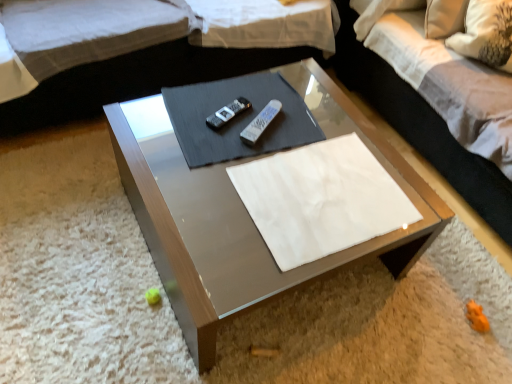
Image resolution: width=512 pixels, height=384 pixels. Describe the element at coordinates (321, 199) in the screenshot. I see `white paper at center` at that location.

Find the location of a particular element. The width and height of the screenshot is (512, 384). metallic glass coffee table at center is located at coordinates (248, 219).

What do you see at coordinates (143, 31) in the screenshot?
I see `white fabric couch at upper center` at bounding box center [143, 31].

This screenshot has height=384, width=512. Describe the element at coordinates (227, 113) in the screenshot. I see `black plastic remote at center, placed as the first remote when sorted from left to right` at that location.

In order to click on white paper at center in this screenshot , I will do `click(321, 199)`.

Is the position of white paper at center more distant than that of black plastic remote at center, arranged as the second remote when viewed from the right?

That is False.

Where is `remote below the white paper at center (from a real-world perspective)`? The height and width of the screenshot is (384, 512). remote below the white paper at center (from a real-world perspective) is located at coordinates (227, 113).

Would you say black plastic remote at center, arranged as the second remote when viewed from the right, is part of white paper at center's contents?

No, black plastic remote at center, arranged as the second remote when viewed from the right, is located outside of white paper at center.

Can you tell me how much white fabric pillow at upper right and black plastic remote at center, placed as the first remote when sorted from left to right, differ in facing direction?

The angle between the facing direction of white fabric pillow at upper right and the facing direction of black plastic remote at center, placed as the first remote when sorted from left to right, is 23.9 degrees.

Find the location of a particular element. This screenshot has width=512, height=384. bedding that appears above the black plastic remote at center, placed as the first remote when sorted from left to right (from a real-world perspective) is located at coordinates (450, 85).

Looking at this image, considering the relative sizes of white fabric pillow at upper right and black plastic remote at center, placed as the first remote when sorted from left to right, in the image provided, is white fabric pillow at upper right smaller than black plastic remote at center, placed as the first remote when sorted from left to right,?

No, white fabric pillow at upper right is not smaller than black plastic remote at center, placed as the first remote when sorted from left to right.

Can you confirm if white fabric pillow at upper right is positioned to the left of black plastic remote at center, placed as the first remote when sorted from left to right?

Incorrect, white fabric pillow at upper right is not on the left side of black plastic remote at center, placed as the first remote when sorted from left to right.

Can you confirm if black plastic remote at center, arranged as the second remote when viewed from the right, is positioned to the left of metallic glass coffee table at center?

Correct, you'll find black plastic remote at center, arranged as the second remote when viewed from the right, to the left of metallic glass coffee table at center.

Is black plastic remote at center, placed as the first remote when sorted from left to right, bigger than metallic glass coffee table at center?

No, black plastic remote at center, placed as the first remote when sorted from left to right, is not bigger than metallic glass coffee table at center.

From a real-world perspective, which remote is the 1st one above the metallic glass coffee table at center? Please provide its 2D coordinates.

[(227, 113)]

Who is shorter, black plastic remote at center, placed as the first remote when sorted from left to right, or metallic glass coffee table at center?

black plastic remote at center, placed as the first remote when sorted from left to right.

Does point (255, 139) lie in front of point (434, 81)?

That is True.

From the picture: Does white plastic remote at center, acting as the 1th remote starting from the right, lie behind white fabric pillow at upper right?

That is True.

At what (x,y) coordinates should I click in order to perform the action: click on bedding on the right side of white plastic remote at center, which is the second remote from left to right. Please return your answer as a coordinate pair (x, y). This screenshot has height=384, width=512. Looking at the image, I should click on (450, 85).

Which of these two, white fabric pillow at upper right or white paper at center, is thinner?

white fabric pillow at upper right.

This screenshot has width=512, height=384. I want to click on pillow on the right side of white paper at center, so click(x=486, y=33).

Is white fabric pillow at upper right facing away from white paper at center?

No.

Does white fabric pillow at upper right have a larger size compared to white paper at center?

Indeed, white fabric pillow at upper right has a larger size compared to white paper at center.

Is white fabric pillow at upper right next to white fabric pillow at upper right?

white fabric pillow at upper right and white fabric pillow at upper right are clearly separated.

Based on the photo, how different are the orientations of white fabric pillow at upper right and white fabric pillow at upper right in degrees?

The angular difference between white fabric pillow at upper right and white fabric pillow at upper right is 40.3 degrees.

Would you say white fabric pillow at upper right is to the left or to the right of white fabric pillow at upper right in the picture?

white fabric pillow at upper right is to the left of white fabric pillow at upper right.

Would you say white fabric pillow at upper right is inside or outside white fabric pillow at upper right?

white fabric pillow at upper right is enclosed within white fabric pillow at upper right.

Considering the relative sizes of metallic glass coffee table at center and black plastic remote at center, placed as the first remote when sorted from left to right, in the image provided, is metallic glass coffee table at center smaller than black plastic remote at center, placed as the first remote when sorted from left to right,?

Incorrect, metallic glass coffee table at center is not smaller in size than black plastic remote at center, placed as the first remote when sorted from left to right.

From a real-world perspective, is metallic glass coffee table at center above or below black plastic remote at center, placed as the first remote when sorted from left to right?

From a real-world perspective, metallic glass coffee table at center is physically below black plastic remote at center, placed as the first remote when sorted from left to right.

Looking at this image, is metallic glass coffee table at center positioned beyond the bounds of black plastic remote at center, arranged as the second remote when viewed from the right?

Yes, metallic glass coffee table at center is outside of black plastic remote at center, arranged as the second remote when viewed from the right.

Find the location of a particular element. Image resolution: width=512 pixels, height=384 pixels. linen above the black plastic remote at center, arranged as the second remote when viewed from the right (from a real-world perspective) is located at coordinates (321, 199).

Where is `the 2nd remote behind when counting from the white fabric pillow at upper right`? This screenshot has width=512, height=384. the 2nd remote behind when counting from the white fabric pillow at upper right is located at coordinates (227, 113).

Based on their spatial positions, is white fabric couch at upper center or white fabric pillow at upper right closer to black plastic remote at center, arranged as the second remote when viewed from the right?

white fabric couch at upper center is positioned closer to the anchor black plastic remote at center, arranged as the second remote when viewed from the right.

When comparing their distances from metallic glass coffee table at center, does white fabric pillow at upper right or white paper at center seem closer?

Based on the image, white paper at center appears to be nearer to metallic glass coffee table at center.

Estimate the real-world distances between objects in this image. Which object is closer to black plastic remote at center, placed as the first remote when sorted from left to right, white fabric pillow at upper right or white plastic remote at center, which is the second remote from left to right?

white plastic remote at center, which is the second remote from left to right, lies closer to black plastic remote at center, placed as the first remote when sorted from left to right, than the other object.

Which object lies further to the anchor point white fabric couch at upper center, metallic glass coffee table at center or black plastic remote at center, arranged as the second remote when viewed from the right?

metallic glass coffee table at center lies further to white fabric couch at upper center than the other object.

Which object lies nearer to the anchor point white paper at center, black plastic remote at center, placed as the first remote when sorted from left to right, or white fabric couch at upper center?

Among the two, black plastic remote at center, placed as the first remote when sorted from left to right, is located nearer to white paper at center.

From the image, which object appears to be nearer to black plastic remote at center, arranged as the second remote when viewed from the right, white fabric pillow at upper right or white paper at center?

white paper at center is closer to black plastic remote at center, arranged as the second remote when viewed from the right.

Looking at the image, which one is located closer to white plastic remote at center, which is the second remote from left to right, white fabric couch at upper center or metallic glass coffee table at center?

metallic glass coffee table at center lies closer to white plastic remote at center, which is the second remote from left to right, than the other object.

From the image, which object appears to be nearer to white fabric pillow at upper right, white fabric pillow at upper right or white paper at center?

Among the two, white fabric pillow at upper right is located nearer to white fabric pillow at upper right.

Find the location of a particular element. This screenshot has height=384, width=512. linen between black plastic remote at center, arranged as the second remote when viewed from the right, and white fabric pillow at upper right is located at coordinates (321, 199).

Image resolution: width=512 pixels, height=384 pixels. Identify the location of remote between white fabric couch at upper center and white plastic remote at center, which is the second remote from left to right, in the up-down direction. [227, 113].

Locate an element on the screen. The width and height of the screenshot is (512, 384). remote located between white paper at center and black plastic remote at center, placed as the first remote when sorted from left to right, in the depth direction is located at coordinates (260, 122).

This screenshot has height=384, width=512. What are the coordinates of `remote situated between black plastic remote at center, placed as the first remote when sorted from left to right, and white fabric pillow at upper right from left to right` in the screenshot? It's located at tap(260, 122).